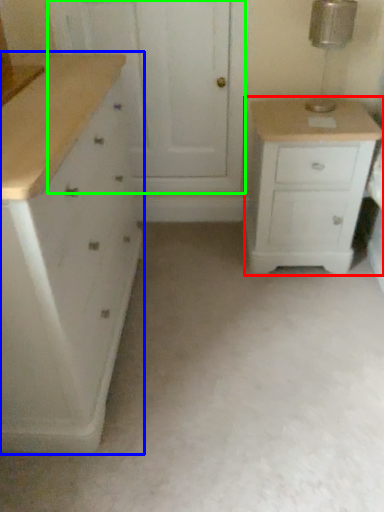
Question: Estimate the real-world distances between objects in this image. Which object is farther from chest of drawers (highlighted by a red box), chest of drawers (highlighted by a blue box) or screen door (highlighted by a green box)?

Choices:
 (A) chest of drawers
 (B) screen door

Answer: (A)